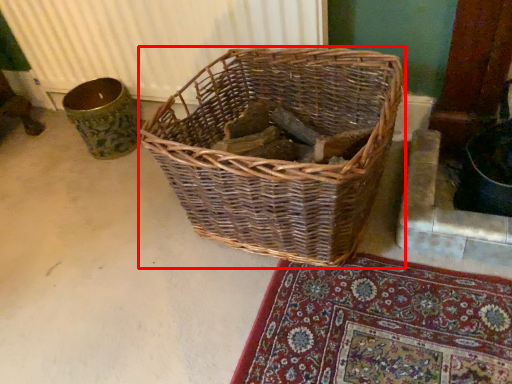
Question: Considering the relative positions of picnic basket (annotated by the red box) and radiator in the image provided, where is picnic basket (annotated by the red box) located with respect to the staircase?

Choices:
 (A) left
 (B) right

Answer: (B)